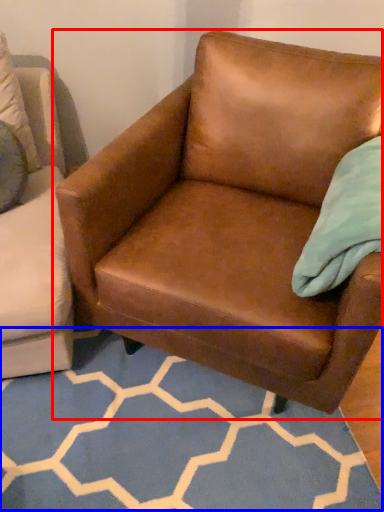
Question: Which of the following is the closest to the observer, chair (highlighted by a red box) or pattern (highlighted by a blue box)?

Choices:
 (A) chair
 (B) pattern

Answer: (A)